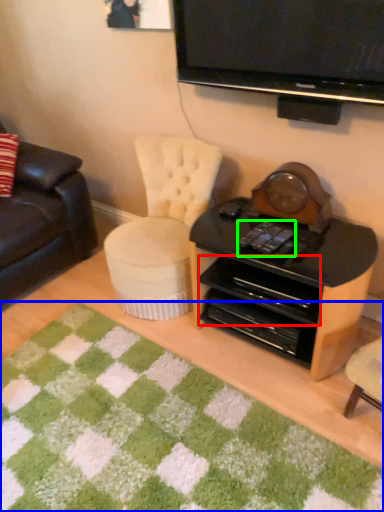
Question: Which object is positioned closest to drawer (highlighted by a red box)? Select from mat (highlighted by a blue box) and remote control (highlighted by a green box).

Choices:
 (A) mat
 (B) remote control

Answer: (B)